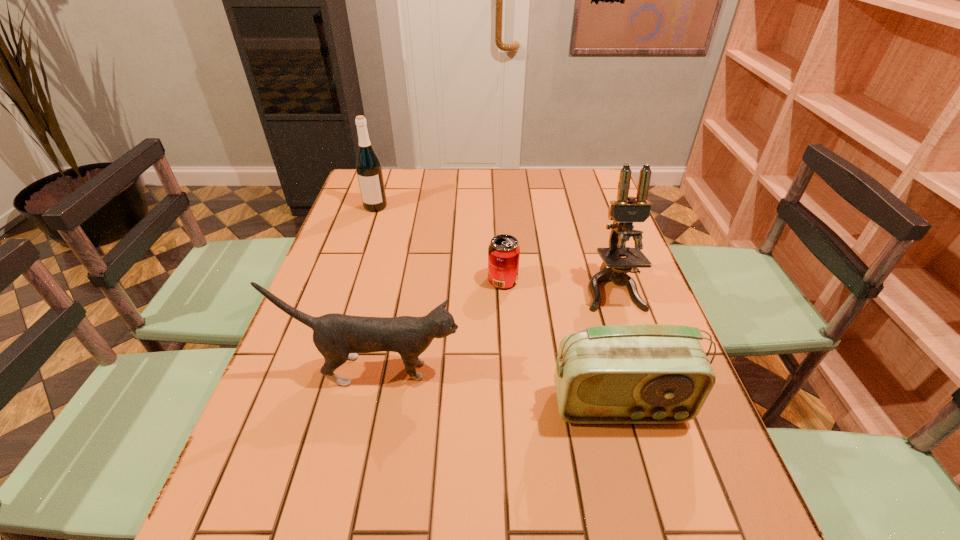
You are a GUI agent. You are given a task and a screenshot of the screen. Output one action in this format:
    pyautogui.click(x=<x>, y=<y>)
    Task: Click on the microscope
    The height and width of the screenshot is (540, 960).
    Given the screenshot: What is the action you would take?
    pyautogui.click(x=626, y=210)

You are a GUI agent. You are given a task and a screenshot of the screen. Output one action in this format:
    pyautogui.click(x=<x>, y=<y>)
    Task: Click on the farthest object
    
    Given the screenshot: What is the action you would take?
    pyautogui.click(x=369, y=171)

At what (x,y) coordinates should I click in order to perform the action: click on cat. Please return your answer as a coordinate pair (x, y). The image size is (960, 540). Looking at the image, I should click on click(x=338, y=337).

What are the coordinates of `radio receiver` in the screenshot? It's located at tap(636, 373).

Where is `the third object from left to right`? Image resolution: width=960 pixels, height=540 pixels. the third object from left to right is located at coordinates (504, 251).

In order to click on the shortest object in this screenshot , I will do click(x=504, y=251).

Image resolution: width=960 pixels, height=540 pixels. In order to click on free space located 0.230m at the eyepieces of the microscope in this screenshot , I will do `click(645, 389)`.

The width and height of the screenshot is (960, 540). Find the location of `free location located on the label of the wine bottle`. free location located on the label of the wine bottle is located at coordinates (357, 262).

At what (x,y) coordinates should I click in order to perform the action: click on vacant space located at the face of the cat. Please return your answer as a coordinate pair (x, y). This screenshot has height=540, width=960. Looking at the image, I should click on (546, 370).

Identify the location of free space located 0.110m on the front panel of the radio receiver. The width and height of the screenshot is (960, 540). (641, 484).